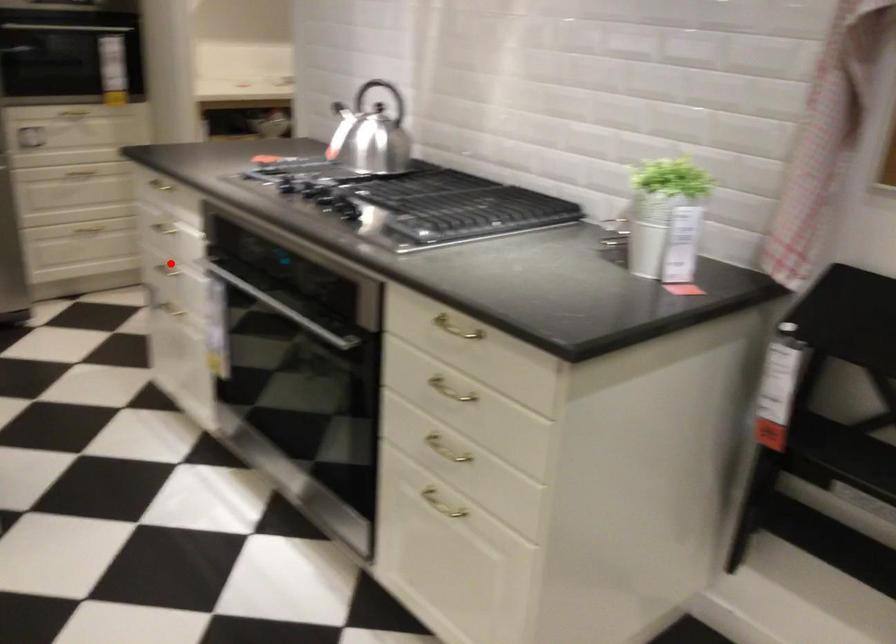
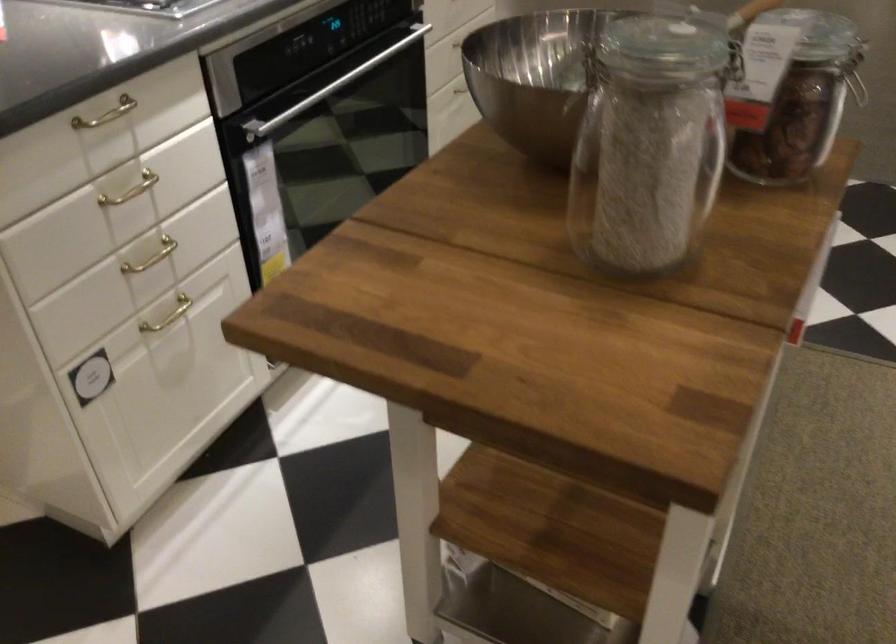
Where in the second image is the point corresponding to the highlighted location from the first image?

(151, 257)